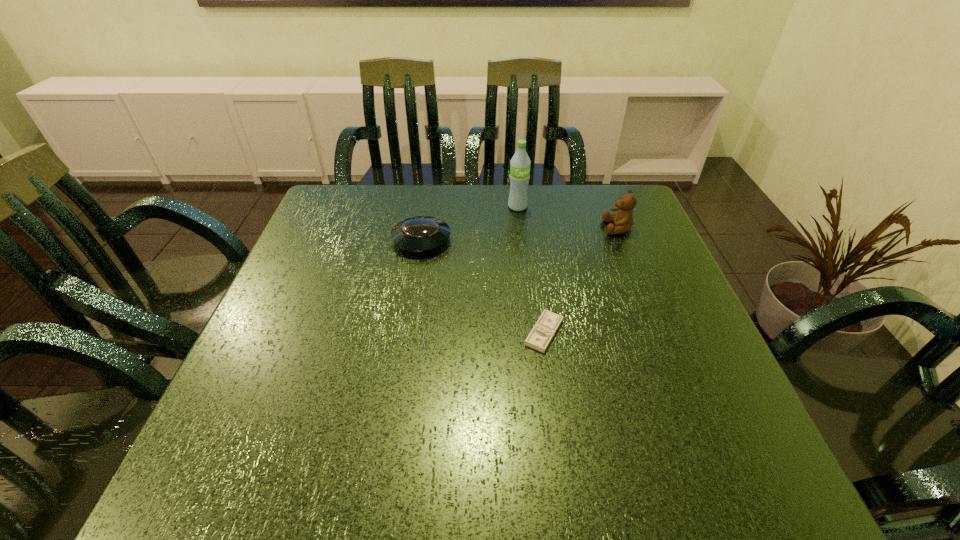
Identify the location of the tallest object. The height and width of the screenshot is (540, 960). (520, 163).

The image size is (960, 540). What are the coordinates of `water bottle` in the screenshot? It's located at (520, 163).

Identify the location of the third shortest object. Image resolution: width=960 pixels, height=540 pixels. (623, 220).

What are the coordinates of `teddy bear` in the screenshot? It's located at (623, 220).

Find the location of a particular element. This screenshot has width=960, height=540. the leftmost object is located at coordinates (421, 233).

Locate an element on the screen. saucer is located at coordinates (421, 233).

The width and height of the screenshot is (960, 540). I want to click on the shortest object, so click(544, 330).

Find the location of a particular element. money is located at coordinates 544,330.

This screenshot has height=540, width=960. In order to click on blank space located 0.100m on the right of the water bottle in this screenshot , I will do point(563,207).

Where is `blank space located 0.110m on the front-facing side of the third shortest object`? The image size is (960, 540). blank space located 0.110m on the front-facing side of the third shortest object is located at coordinates (563, 228).